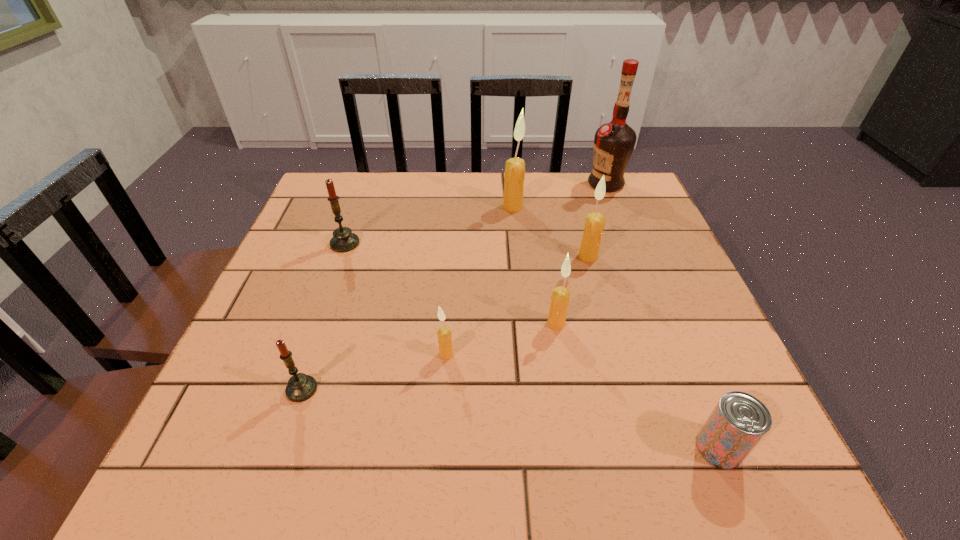
Where is `the nearest candle`? Image resolution: width=960 pixels, height=540 pixels. the nearest candle is located at coordinates (301, 387).

The height and width of the screenshot is (540, 960). Identify the location of the nearest cream candle. click(x=444, y=333).

This screenshot has width=960, height=540. In order to click on the smallest cream candle in this screenshot , I will do `click(444, 333)`.

The image size is (960, 540). Find the location of `the nearest object`. the nearest object is located at coordinates (739, 421).

This screenshot has width=960, height=540. What are the coordinates of `red beer can` in the screenshot? It's located at (739, 421).

You are a GUI agent. You are given a task and a screenshot of the screen. Output one action in this format:
    pyautogui.click(x=<x>, y=<y>)
    Task: Click on the free location located 0.100m on the front and back of the liquor
    
    Given the screenshot: What is the action you would take?
    pyautogui.click(x=552, y=184)

Locate an element on the screen. The height and width of the screenshot is (540, 960). free space located 0.400m on the front and back of the liquor is located at coordinates (449, 184).

Find the location of a particular element. This screenshot has width=960, height=540. free space located on the front and back of the liquor is located at coordinates (491, 184).

Locate an element on the screen. This screenshot has width=960, height=540. vacant point located on the right of the fourth object from left to right is located at coordinates (634, 207).

Where is `free space located 0.400m on the left of the third nearest cream candle`? The width and height of the screenshot is (960, 540). free space located 0.400m on the left of the third nearest cream candle is located at coordinates (409, 256).